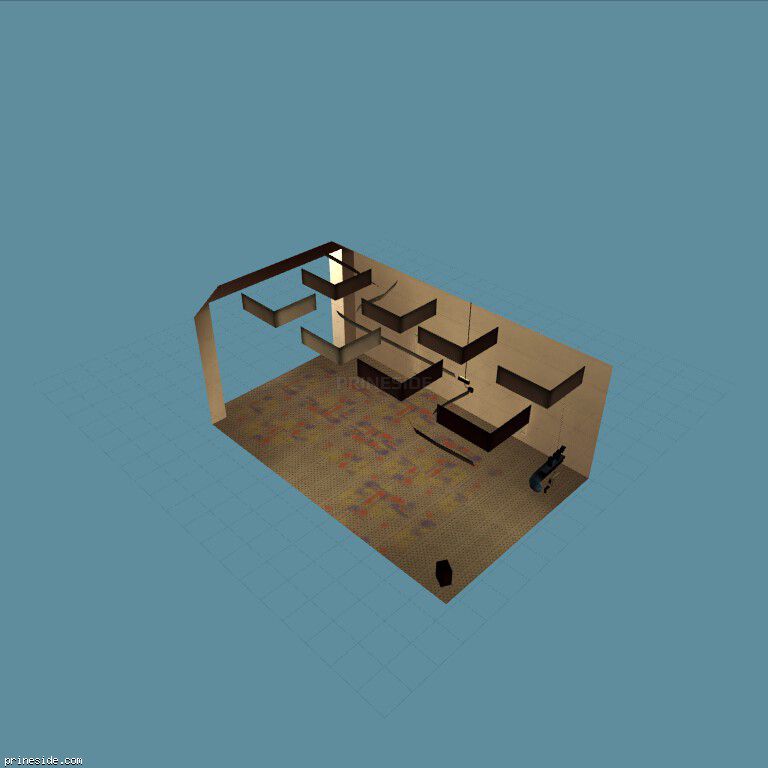
You are a GUI agent. You are given a task and a screenshot of the screen. Output one action in this format:
    pyautogui.click(x=<x>, y=<y>)
    Task: Click on the flooring
    Image resolution: width=768 pixels, height=768 pixels.
    Given the screenshot: What is the action you would take?
    pyautogui.click(x=378, y=471)